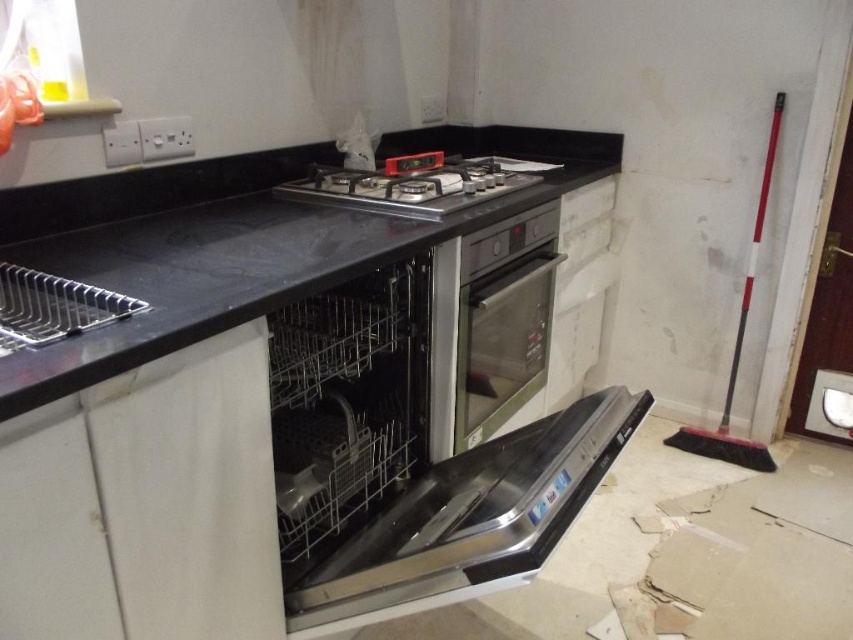
Question: Which of the following is the closest to the observer?

Choices:
 (A) (337, 493)
 (B) (408, 554)
 (C) (410, 198)

Answer: (B)

Question: Does stainless steel dishwasher at center appear over satin stainless steel dishwasher at center?

Choices:
 (A) yes
 (B) no

Answer: (B)

Question: Which point is farther to the camera?

Choices:
 (A) black matte counter top at center
 (B) satin stainless steel dishwasher at center
 (C) stainless steel dishwasher at center
 (D) satin silver oven at center

Answer: (D)

Question: Which of the following is the closest to the observer?

Choices:
 (A) black matte gas stove at center
 (B) satin silver oven at center
 (C) satin stainless steel dishwasher at center
 (D) metallic silver sink at upper left

Answer: (D)

Question: Is black matte counter top at center bigger than metallic silver sink at upper left?

Choices:
 (A) yes
 (B) no

Answer: (A)

Question: Does satin silver oven at center have a larger size compared to black matte gas stove at center?

Choices:
 (A) no
 (B) yes

Answer: (A)